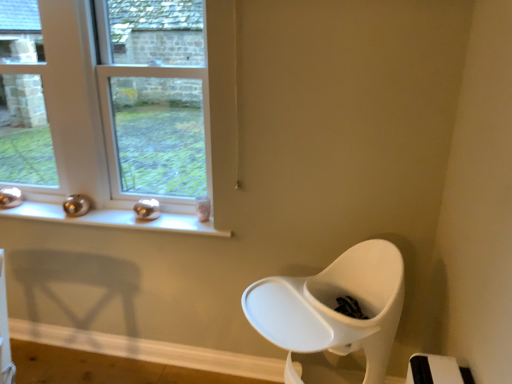
Locate an element on the screen. This screenshot has width=512, height=384. free spot above clear glass window at left, arranged as the 2th window when viewed from the right (from a real-world perspective) is located at coordinates (18, 1).